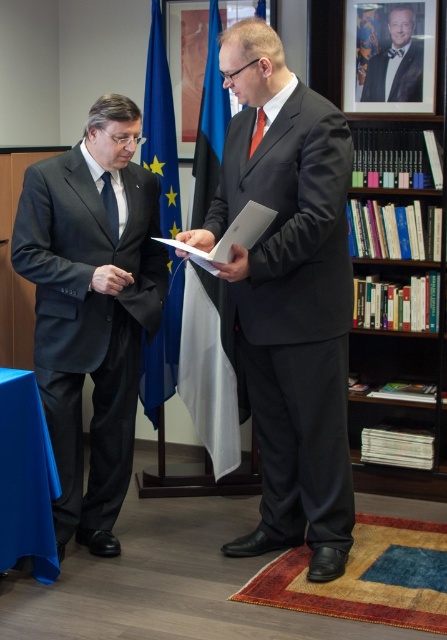
Question: Is matte black suit at left to the right of brown wooden bookshelf at right from the viewer's perspective?

Choices:
 (A) no
 (B) yes

Answer: (A)

Question: Is black satin bow tie at upper center thinner than black silk tie at left?

Choices:
 (A) no
 (B) yes

Answer: (A)

Question: Does blue fabric flag at center appear under black silk tie at left?

Choices:
 (A) no
 (B) yes

Answer: (B)

Question: Which object is farther from the camera taking this photo?

Choices:
 (A) brown wooden bookshelf at right
 (B) matte black suit at center

Answer: (A)

Question: Which point appears closest to the camera in this image?

Choices:
 (A) pos(156,35)
 (B) pos(230,44)
 (C) pos(70,205)

Answer: (B)

Question: Which point is farther from the camera taking this photo?

Choices:
 (A) (97, 513)
 (B) (361, 337)
 (C) (240, 134)
 (D) (409, 65)

Answer: (B)